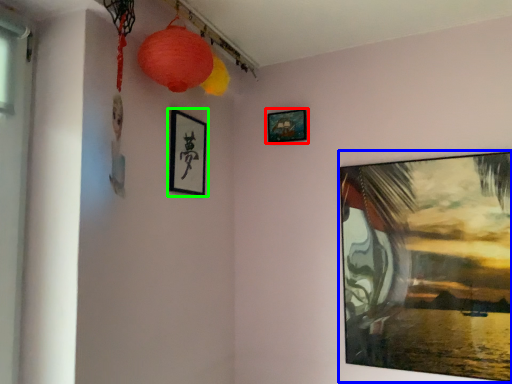
Question: Which object is the closest to the picture frame (highlighted by a red box)? Choose among these: picture frame (highlighted by a blue box) or picture frame (highlighted by a green box).

Choices:
 (A) picture frame
 (B) picture frame

Answer: (B)